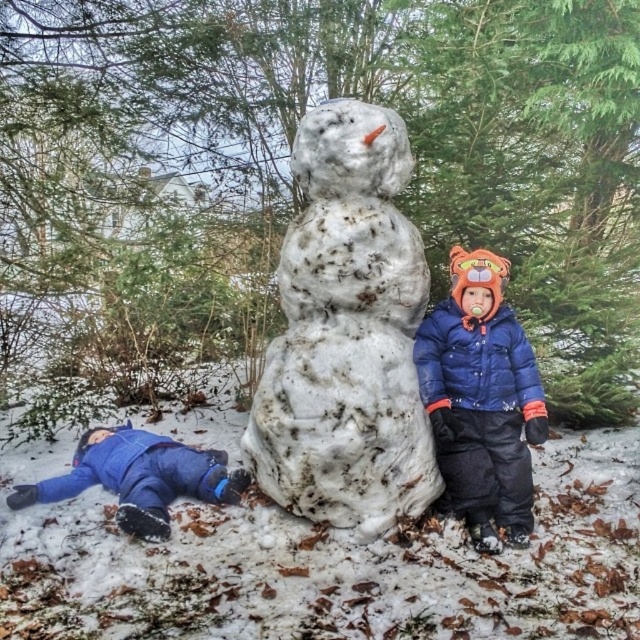
Question: From the image, what is the correct spatial relationship of white textured snowman at center in relation to blue fleece jacket at lower left?

Choices:
 (A) below
 (B) above

Answer: (B)

Question: Which of the following is the closest to the observer?

Choices:
 (A) (352, 246)
 (B) (237, 481)
 (C) (524, 342)

Answer: (A)

Question: Is blue down jacket at center wider than blue fleece jacket at lower left?

Choices:
 (A) yes
 (B) no

Answer: (B)

Question: Which point appears closest to the camera in this image?

Choices:
 (A) (474, 276)
 (B) (40, 486)

Answer: (A)

Question: Is white textured snowman at center thinner than blue down jacket at center?

Choices:
 (A) no
 (B) yes

Answer: (A)

Question: Considering the real-world distances, which object is closest to the blue down jacket at center?

Choices:
 (A) blue fleece jacket at lower left
 (B) white textured snowman at center

Answer: (B)